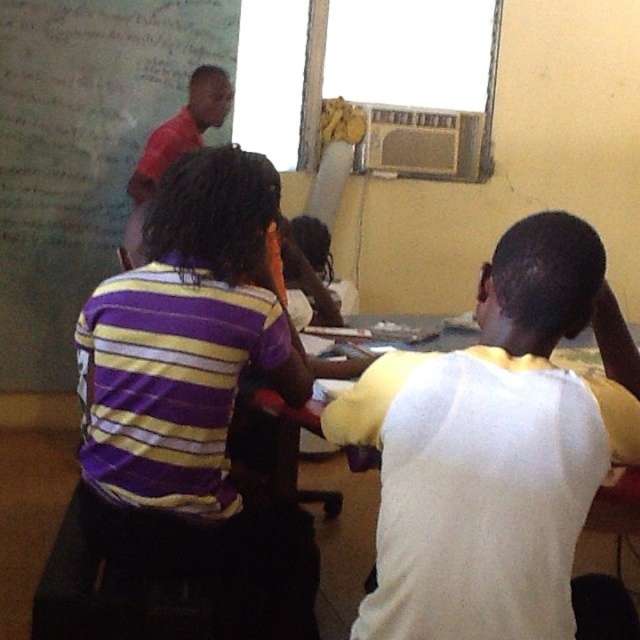
You are standing in the classroom and see the white yellow raglan sleeve shirt at center. Can you tell me what is located at the point (493, 448)?

The point (493, 448) has the white yellow raglan sleeve shirt at center located there.